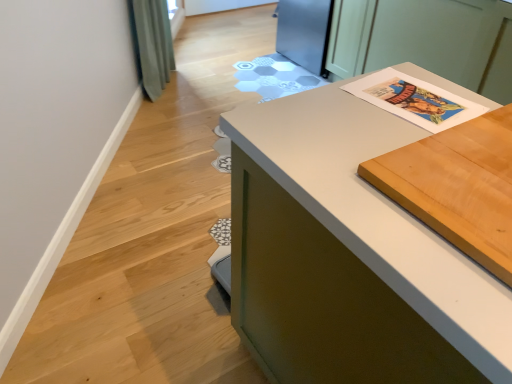
This screenshot has width=512, height=384. What do you see at coordinates (426, 40) in the screenshot?
I see `white paper at upper right` at bounding box center [426, 40].

What is the approximate height of white paper at upper right?

The height of white paper at upper right is 75.40 centimeters.

Describe the element at coordinates (349, 256) in the screenshot. I see `white matte countertop at center` at that location.

Where is `white paper at upper right`? white paper at upper right is located at coordinates (426, 40).

Who is smaller, white paper at upper right or light brown wood cutting board at upper right?

light brown wood cutting board at upper right.

From a real-world perspective, who is located higher, white paper at upper right or light brown wood cutting board at upper right?

In real-world perspective, light brown wood cutting board at upper right is above.

Is white paper at upper right completely or partially outside of light brown wood cutting board at upper right?

Yes, white paper at upper right is located beyond the bounds of light brown wood cutting board at upper right.

Is white paper at upper right with light brown wood cutting board at upper right?

No, white paper at upper right is not in contact with light brown wood cutting board at upper right.

How many degrees apart are the facing directions of white matte countertop at center and light brown wood cutting board at upper right?

white matte countertop at center and light brown wood cutting board at upper right are facing 90.9 degrees away from each other.

Between white matte countertop at center and light brown wood cutting board at upper right, which one has smaller size?

light brown wood cutting board at upper right is smaller.

This screenshot has width=512, height=384. I want to click on table that is above the white matte countertop at center (from a real-world perspective), so click(x=458, y=186).

From a real-world perspective, between white matte countertop at center and light brown wood cutting board at upper right, who is vertically lower?

white matte countertop at center, from a real-world perspective.

Is light brown wood cutting board at upper right wider than white matte countertop at center?

No.

Can you confirm if light brown wood cutting board at upper right is positioned to the right of white matte countertop at center?

Indeed, light brown wood cutting board at upper right is positioned on the right side of white matte countertop at center.

Is light brown wood cutting board at upper right looking in the opposite direction of white matte countertop at center?

Correct, light brown wood cutting board at upper right is looking away from white matte countertop at center.

From a real-world perspective, between light brown wood cutting board at upper right and white matte countertop at center, who is vertically higher?

light brown wood cutting board at upper right.

Does point (325, 347) appear closer or farther from the camera than point (475, 46)?

Clearly, point (325, 347) is closer to the camera than point (475, 46).

Is white matte countertop at center further to the viewer compared to white paper at upper right?

No, white matte countertop at center is closer to the camera.

How much distance is there between white matte countertop at center and white paper at upper right?

5.12 feet.

Between white matte countertop at center and white paper at upper right, which one has smaller size?

With smaller size is white matte countertop at center.

Can you confirm if white paper at upper right is smaller than white matte countertop at center?

Actually, white paper at upper right might be larger than white matte countertop at center.

Is white paper at upper right oriented away from white matte countertop at center?

No, white paper at upper right is not facing the opposite direction of white matte countertop at center.

Based on the photo, which object is closer to the camera, white paper at upper right or white matte countertop at center?

Positioned in front is white matte countertop at center.

Considering the relative sizes of light brown wood cutting board at upper right and white paper at upper right in the image provided, is light brown wood cutting board at upper right smaller than white paper at upper right?

Yes, light brown wood cutting board at upper right is smaller than white paper at upper right.

Measure the distance between light brown wood cutting board at upper right and white paper at upper right.

A distance of 1.56 meters exists between light brown wood cutting board at upper right and white paper at upper right.

Is light brown wood cutting board at upper right facing towards white paper at upper right?

No, light brown wood cutting board at upper right does not turn towards white paper at upper right.

Considering the relative positions of light brown wood cutting board at upper right and white paper at upper right in the image provided, is light brown wood cutting board at upper right in front of white paper at upper right?

Yes, the depth of light brown wood cutting board at upper right is less than that of white paper at upper right.

Image resolution: width=512 pixels, height=384 pixels. In the image, there is a light brown wood cutting board at upper right. In order to click on cabinetry below it (from a real-world perspective) in this screenshot , I will do `click(426, 40)`.

Where is `countertop located behind the light brown wood cutting board at upper right`? This screenshot has height=384, width=512. countertop located behind the light brown wood cutting board at upper right is located at coordinates (349, 256).

Estimate the real-world distances between objects in this image. Which object is closer to white matte countertop at center, light brown wood cutting board at upper right or white paper at upper right?

light brown wood cutting board at upper right lies closer to white matte countertop at center than the other object.

Based on their spatial positions, is white matte countertop at center or white paper at upper right further from light brown wood cutting board at upper right?

The object further to light brown wood cutting board at upper right is white paper at upper right.

Based on their spatial positions, is white matte countertop at center or light brown wood cutting board at upper right further from white paper at upper right?

The object further to white paper at upper right is light brown wood cutting board at upper right.

From the image, which object appears to be farther from white matte countertop at center, white paper at upper right or light brown wood cutting board at upper right?

white paper at upper right is positioned further to the anchor white matte countertop at center.

Looking at the image, which one is located closer to white paper at upper right, light brown wood cutting board at upper right or white matte countertop at center?

The object closer to white paper at upper right is white matte countertop at center.

Considering their positions, is white paper at upper right positioned closer to light brown wood cutting board at upper right than white matte countertop at center?

Among the two, white matte countertop at center is located nearer to light brown wood cutting board at upper right.

Image resolution: width=512 pixels, height=384 pixels. I want to click on countertop between light brown wood cutting board at upper right and white paper at upper right along the z-axis, so click(349, 256).